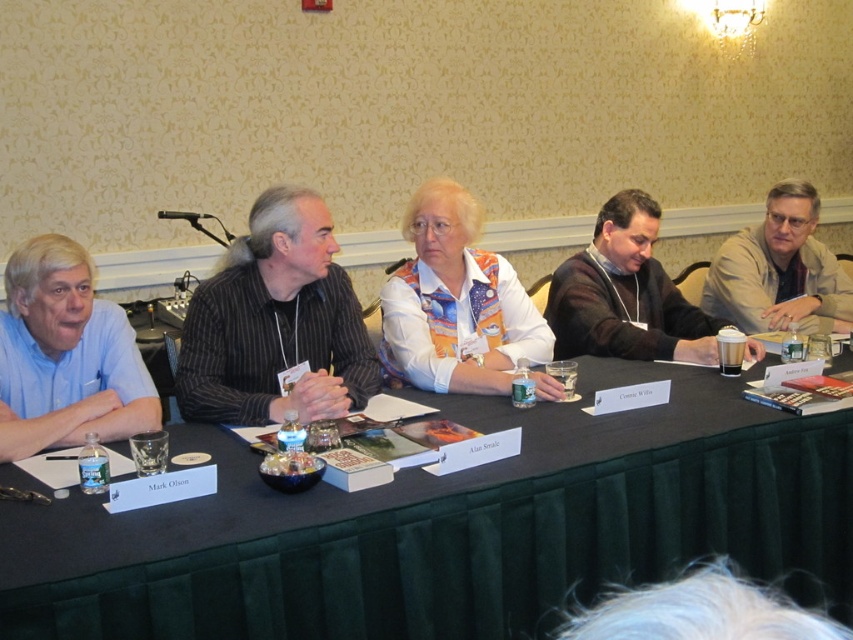
Can you confirm if black striped shirt at center is wider than dark brown sweater at center?

Incorrect, black striped shirt at center's width does not surpass dark brown sweater at center's.

Does black striped shirt at center have a larger size compared to dark brown sweater at center?

No, black striped shirt at center is not bigger than dark brown sweater at center.

What do you see at coordinates (276, 323) in the screenshot? I see `black striped shirt at center` at bounding box center [276, 323].

Find the location of `black striped shirt at center`. black striped shirt at center is located at coordinates (276, 323).

Based on the photo, is black striped shirt at center to the right of white textured shirt at center from the viewer's perspective?

Incorrect, black striped shirt at center is not on the right side of white textured shirt at center.

Does black striped shirt at center have a lesser width compared to white textured shirt at center?

Yes.

Locate an element on the screen. This screenshot has height=640, width=853. black striped shirt at center is located at coordinates (276, 323).

Identify the location of black striped shirt at center. (276, 323).

Which of these two, green fabric table at center or black striped shirt at center, stands taller?

Standing taller between the two is green fabric table at center.

Is green fabric table at center above black striped shirt at center?

No.

The image size is (853, 640). I want to click on green fabric table at center, so click(454, 525).

Where is `green fabric table at center`? The width and height of the screenshot is (853, 640). green fabric table at center is located at coordinates (454, 525).